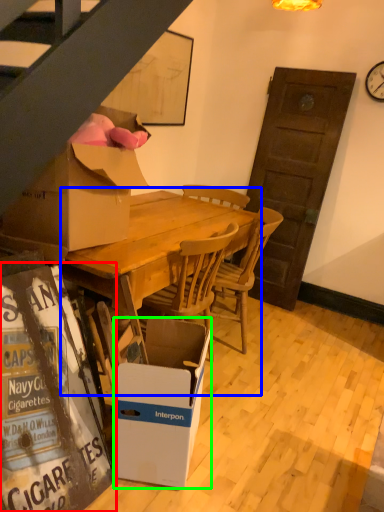
Question: Which is farther away from bulletin board (highlighted by a red box)? round table (highlighted by a blue box) or box (highlighted by a green box)?

Choices:
 (A) round table
 (B) box

Answer: (A)